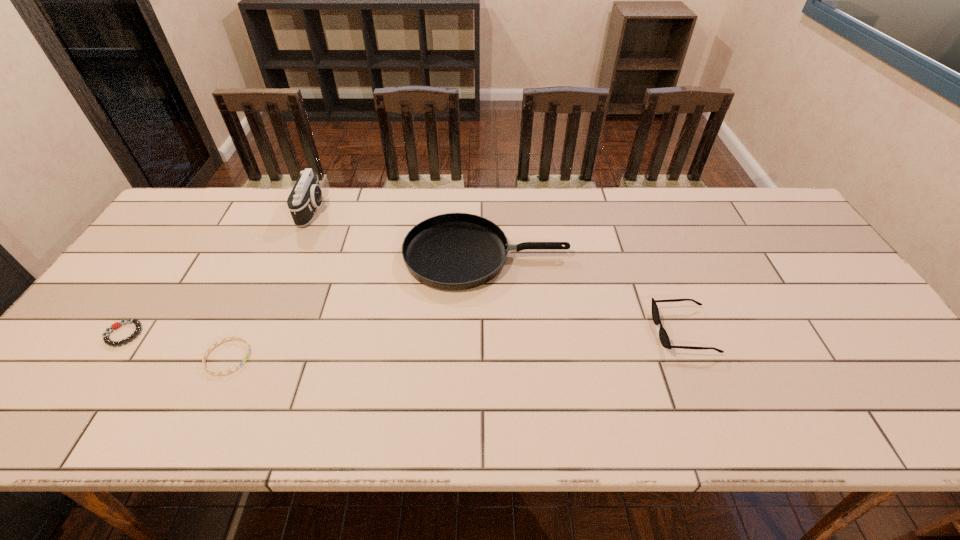
In order to click on the tallest object in this screenshot , I will do pyautogui.click(x=306, y=196).

The image size is (960, 540). In order to click on the fourth object from left to right in this screenshot , I will do pyautogui.click(x=453, y=251).

Where is `the rightmost object`? the rightmost object is located at coordinates (664, 339).

What are the coordinates of `the right bracelet` in the screenshot? It's located at (239, 338).

Image resolution: width=960 pixels, height=540 pixels. I want to click on the left bracelet, so click(x=137, y=323).

Image resolution: width=960 pixels, height=540 pixels. I want to click on vacant point located on the front lens of the tallest object, so click(427, 210).

You are a GUI agent. You are given a task and a screenshot of the screen. Output one action in this format:
    pyautogui.click(x=<x>, y=<y>)
    Task: Click on the vacant space positioned on the handle side of the second object from right to left
    The image size is (960, 540).
    Given the screenshot: What is the action you would take?
    pyautogui.click(x=651, y=255)

Locate an element on the screen. vacant area situated 0.330m on the front-facing side of the sunglasses is located at coordinates (524, 330).

Identify the location of free space located on the front-facing side of the sunglasses. The image size is (960, 540). (620, 330).

Image resolution: width=960 pixels, height=540 pixels. What are the coordinates of `vacant region located on the front-facing side of the sunglasses` in the screenshot? It's located at (544, 330).